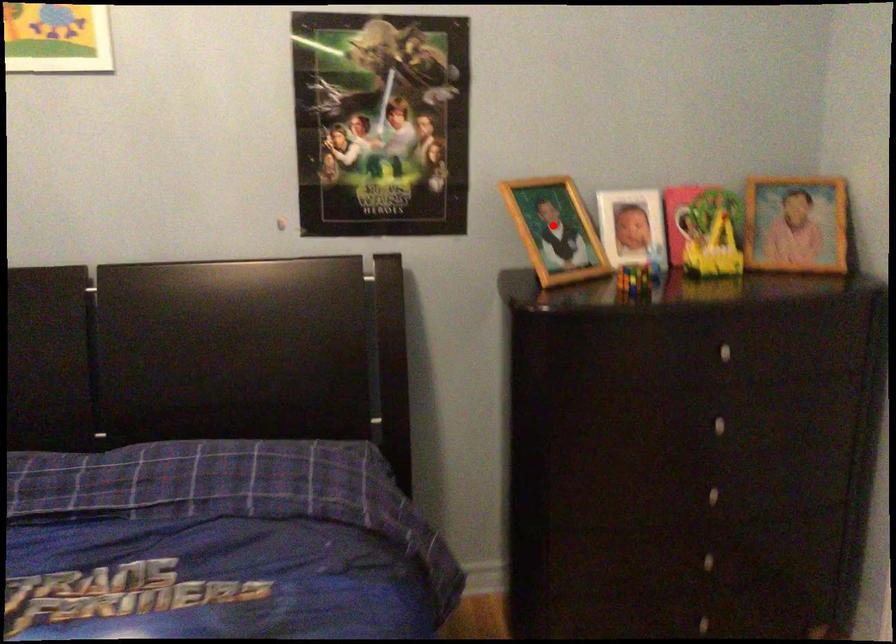
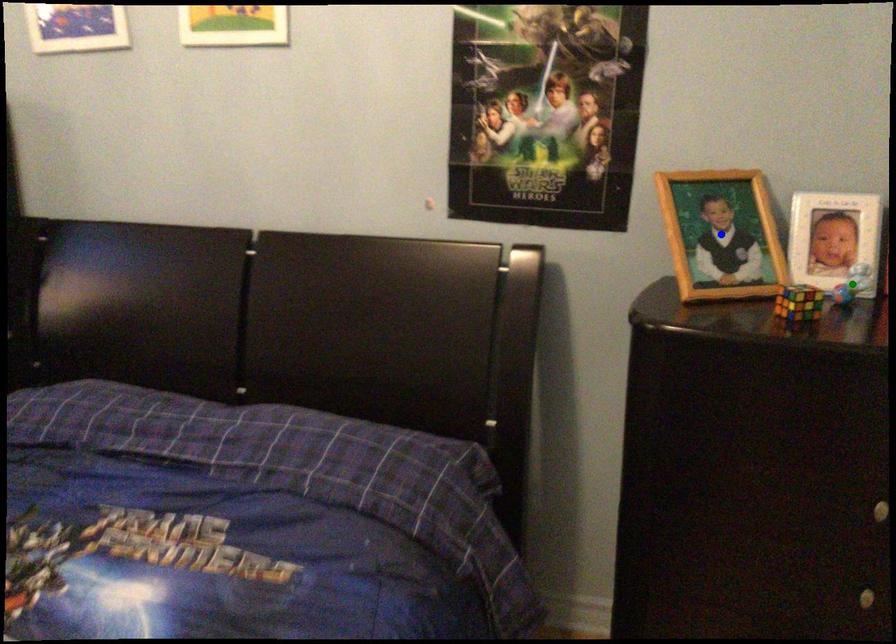
Question: I am providing you with two images of the same scene from different viewpoints. A red point is marked on the first image. You are given multiple points on the second image. Which point in image 2 represents the same 3d spot as the red point in image 1?

Choices:
 (A) yellow point
 (B) green point
 (C) blue point

Answer: (C)